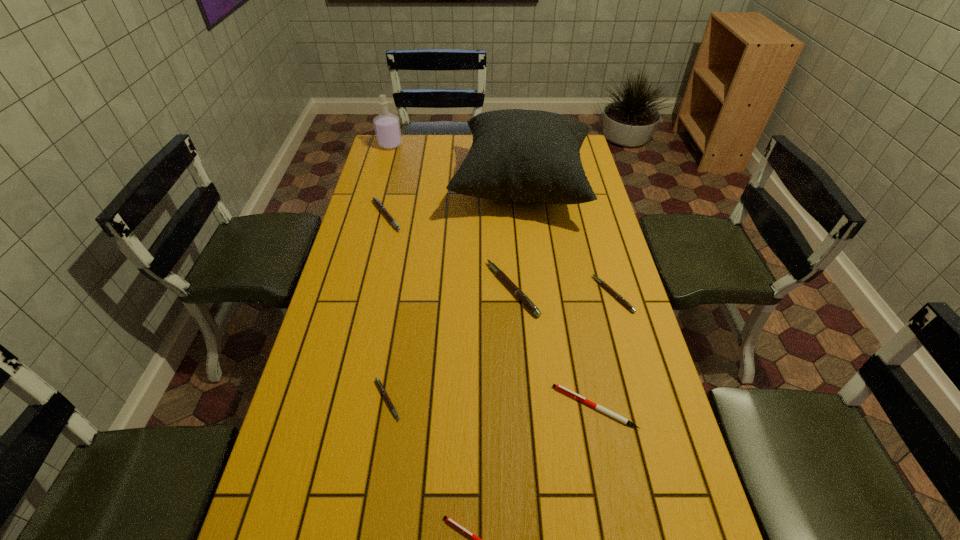
This screenshot has height=540, width=960. In order to click on the right white pen in this screenshot , I will do `click(558, 387)`.

Where is `the sixth object from right to left`? The width and height of the screenshot is (960, 540). the sixth object from right to left is located at coordinates (382, 389).

You are a GUI agent. You are given a task and a screenshot of the screen. Output one action in this format:
    pyautogui.click(x=<x>, y=<y>)
    Task: Click on the second pink pen from left to right
    Image resolution: width=960 pixels, height=540 pixels.
    Given the screenshot: What is the action you would take?
    pyautogui.click(x=382, y=389)

Locate an element on the screen. vacant space located 0.150m on the front of the black cushion is located at coordinates (531, 262).

At what (x,y) coordinates should I click in order to perform the action: click on free space located 0.190m on the right of the second tallest object. Please return your answer as a coordinate pair (x, y). Looking at the image, I should click on (445, 145).

At what (x,y) coordinates should I click in order to perform the action: click on free location located 0.300m at the nib of the third pink pen from left to right. Please return your answer as a coordinate pair (x, y). The width and height of the screenshot is (960, 540). Looking at the image, I should click on (390, 289).

Locate an element on the screen. The width and height of the screenshot is (960, 540). free location located 0.130m at the nib of the third pink pen from left to right is located at coordinates (445, 289).

In order to click on free space located at the nib of the third pink pen from left to right in this screenshot , I will do `click(439, 289)`.

This screenshot has height=540, width=960. In order to click on vacant space located 0.160m at the nib of the farthest pink pen in this screenshot , I will do `click(448, 216)`.

Find the location of a particular element. The width and height of the screenshot is (960, 540). free space located 0.060m at the nib of the third biggest pink pen is located at coordinates (576, 294).